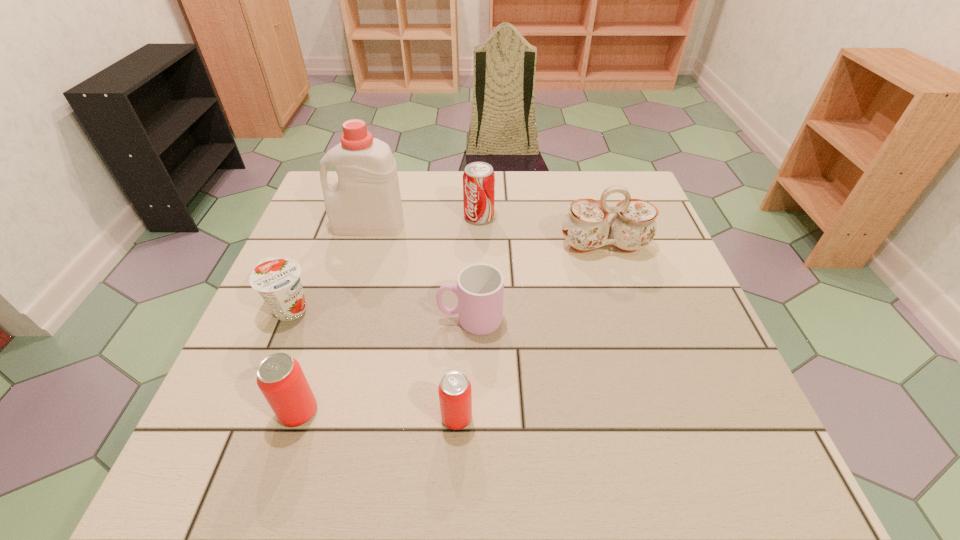
Locate an element on the screen. Image resolution: width=960 pixels, height=540 pixels. vacant space situated 0.260m on the left of the soda can is located at coordinates tap(369, 217).

Identify the location of vacant point located 0.250m with the handle on the side of the cup. (321, 319).

The height and width of the screenshot is (540, 960). Identify the location of vacant space located with the handle on the side of the cup. (x=265, y=319).

At what (x,y) coordinates should I click in order to perform the action: click on free location located with the handle on the side of the cup. Please return your answer as a coordinate pair (x, y). Image resolution: width=960 pixels, height=540 pixels. Looking at the image, I should click on (330, 319).

The image size is (960, 540). Find the location of `blank space located on the back of the yogurt`. blank space located on the back of the yogurt is located at coordinates (328, 218).

I want to click on detergent located at the far edge, so click(x=366, y=201).

Locate an element on the screen. The height and width of the screenshot is (540, 960). soda can at the far edge is located at coordinates (478, 178).

Where is `beer can situated at the left edge`? The width and height of the screenshot is (960, 540). beer can situated at the left edge is located at coordinates (280, 378).

You are a GUI agent. You are given a task and a screenshot of the screen. Output one action in this format:
    pyautogui.click(x=<x>, y=<y>)
    Task: Click on the detergent that is at the left edge
    This screenshot has width=960, height=540.
    Given the screenshot: What is the action you would take?
    pyautogui.click(x=366, y=201)

I want to click on yogurt positioned at the left edge, so click(x=277, y=280).